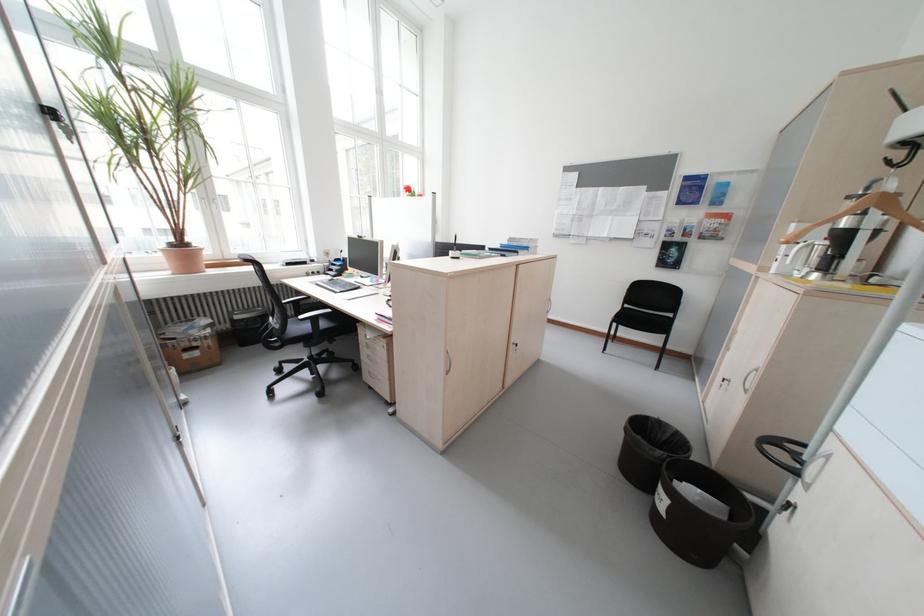
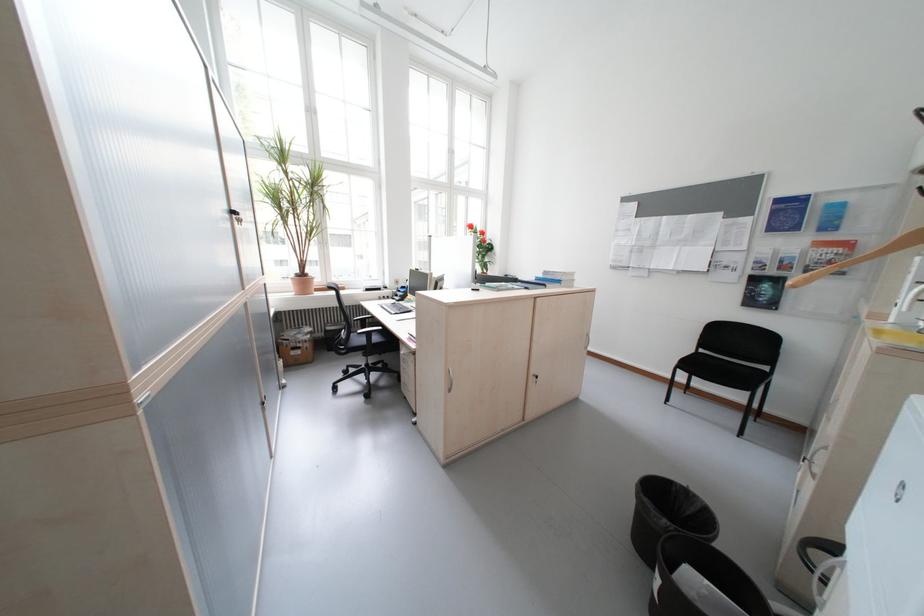
The point at (x=693, y=246) is marked in the first image. Where is the corresponding point in the second image?

(788, 282)